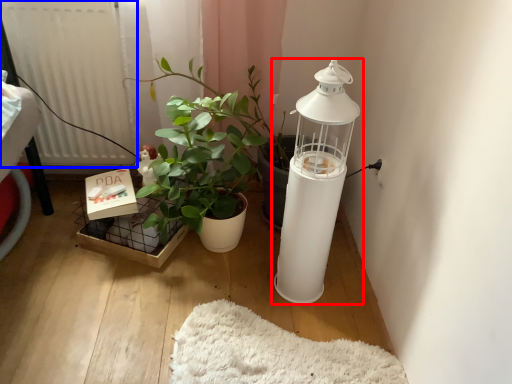
Question: Which of the following is the closest to the observer, lamp (highlighted by a red box) or radiator (highlighted by a blue box)?

Choices:
 (A) lamp
 (B) radiator

Answer: (A)